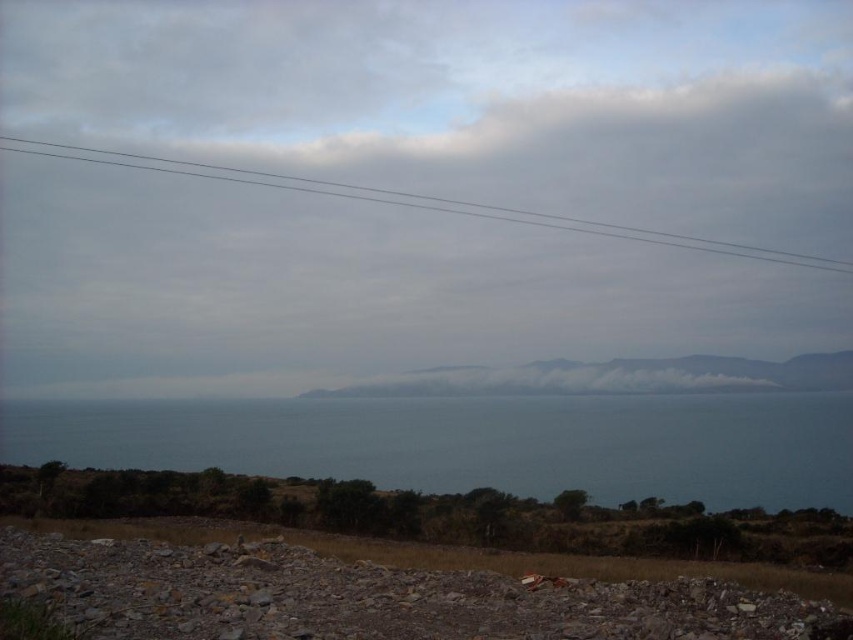
Which of these two, blue water at center or gray wire at upper center, stands shorter?

Standing shorter between the two is blue water at center.

Which is behind, point (288, 420) or point (524, 220)?

The point (524, 220) is behind.

The width and height of the screenshot is (853, 640). What are the coordinates of `blue water at center` in the screenshot? It's located at (476, 442).

Between gray gravel pile at lower center and gray wire at upper center, which one is positioned lower?

gray gravel pile at lower center

Is gray gravel pile at lower center to the right of gray wire at upper center from the viewer's perspective?

Incorrect, gray gravel pile at lower center is not on the right side of gray wire at upper center.

Which is behind, point (767, 608) or point (654, 236)?

Positioned behind is point (654, 236).

Locate an element on the screen. gray gravel pile at lower center is located at coordinates (370, 596).

Does blue water at center lie in front of gray gravel pile at lower center?

That is False.

Is point (440, 477) less distant than point (624, 600)?

No, it is not.

Where is `blue water at center`? The width and height of the screenshot is (853, 640). blue water at center is located at coordinates (476, 442).